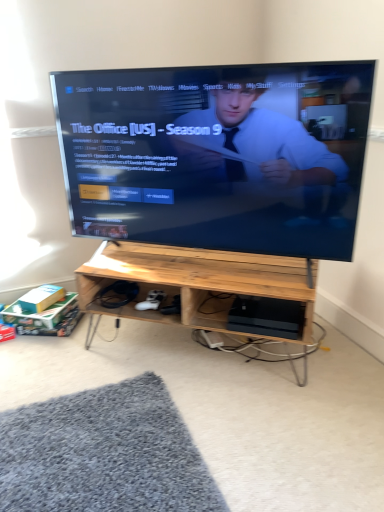
The height and width of the screenshot is (512, 384). I want to click on empty space that is ontop of natural wood desk at center (from a real-world perspective), so click(x=196, y=259).